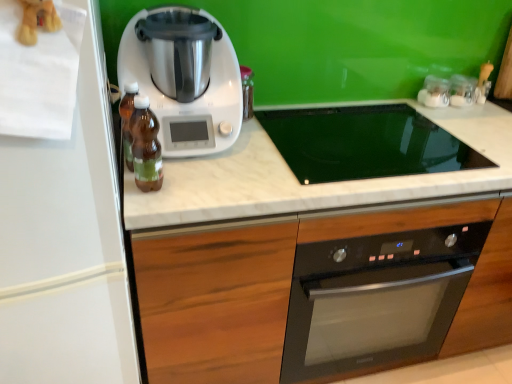
In order to click on vacant space in between brown glass bottle at left, positioned as the 2th bottle in front-to-back order, and clear glass jars at upper right, marked as the first appliance in a right-to-left arrangement in this screenshot , I will do `click(332, 129)`.